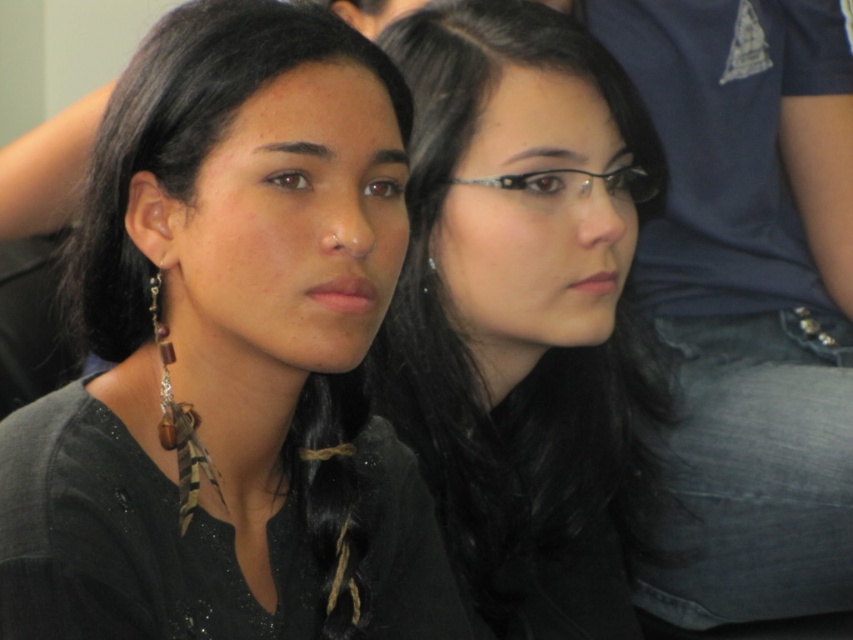
You are taking a photo of two people sitting next to each other. You notice the black matte hair at upper left and the clear plastic glasses at center. Which object should you adjust to ensure both are in focus? Explain your reasoning.

The black matte hair at upper left is much taller than the clear plastic glasses at center. To ensure both are in focus, you should adjust the camera to focus on the black matte hair at upper left since it is taller and might be further away, requiring a larger depth of field to capture both objects clearly.